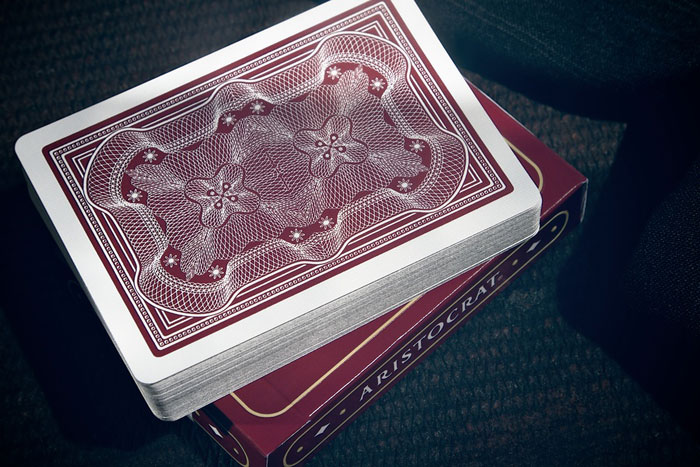
Identify the location of card box. This screenshot has height=467, width=700. (550, 195).